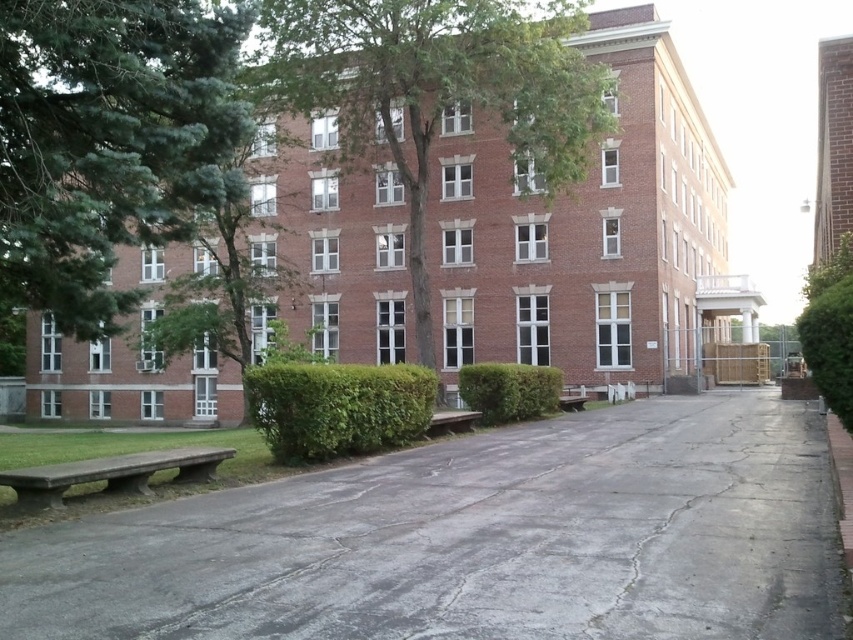
Question: Which object is the closest to the wooden park bench at center?

Choices:
 (A) green leafy hedge at center
 (B) green leafy tree at center

Answer: (A)

Question: Can you confirm if green leafy tree at upper left is positioned to the left of wooden park bench at center?

Choices:
 (A) no
 (B) yes

Answer: (B)

Question: Observing the image, what is the correct spatial positioning of brown wooden bench at center in reference to wooden park bench at center?

Choices:
 (A) right
 (B) left

Answer: (B)

Question: Does concrete bench at lower left lie in front of green leafy bush at center?

Choices:
 (A) yes
 (B) no

Answer: (A)

Question: Among these objects, which one is nearest to the camera?

Choices:
 (A) green leafy bush at center
 (B) green leafy hedge at center

Answer: (B)

Question: Estimate the real-world distances between objects in this image. Which object is closer to the green leafy tree at center?

Choices:
 (A) wooden park bench at center
 (B) concrete bench at lower left
 (C) green leafy hedge at center

Answer: (A)